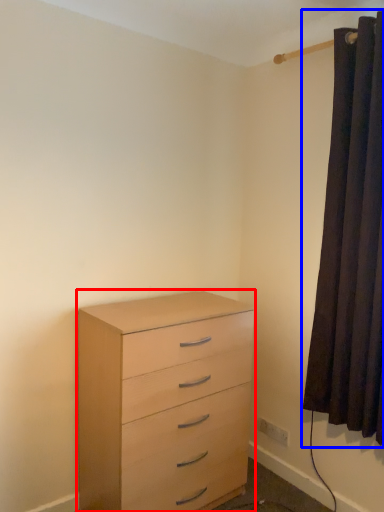
Question: Which object appears farthest to the camera in this image, chest of drawers (highlighted by a red box) or curtain (highlighted by a blue box)?

Choices:
 (A) chest of drawers
 (B) curtain

Answer: (A)